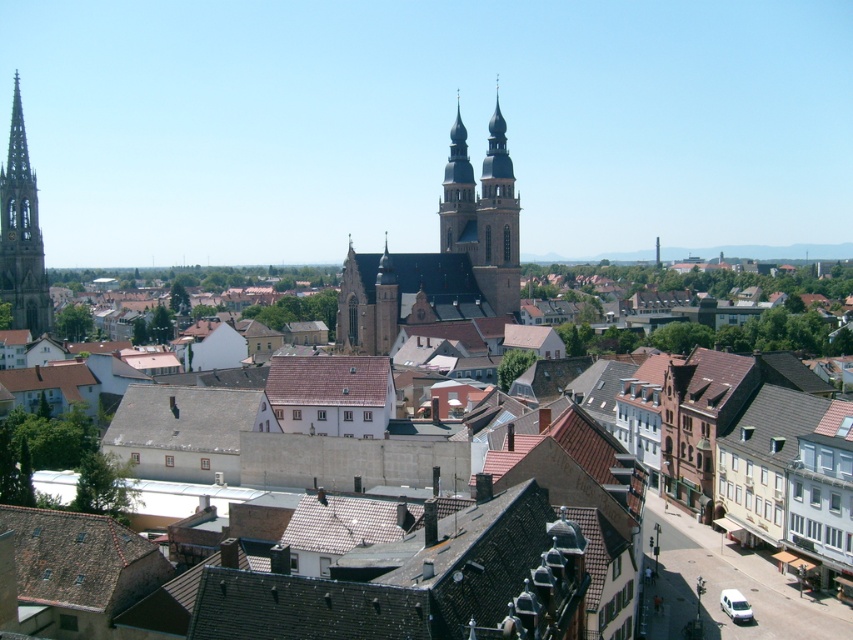
You are standing at the point labeled point (483,214) in the image of a European town. What is the name of the structure you are standing on?

The point (483,214) is on smooth stone church towers at center.

You are a drone operator tasked with capturing aerial footage of the town. Your drone can only fly up to 250 feet away from its starting position. If you position yourself at the smooth stone church towers at center, will you be able to capture the brown tile roof at center in your footage without exceeding the drone flight limit?

The distance between the smooth stone church towers at center and the brown tile roof at center is 276.57 feet, which exceeds the drone flight limit of 250 feet. Therefore, the drone cannot capture the brown tile roof at center without exceeding the limit.